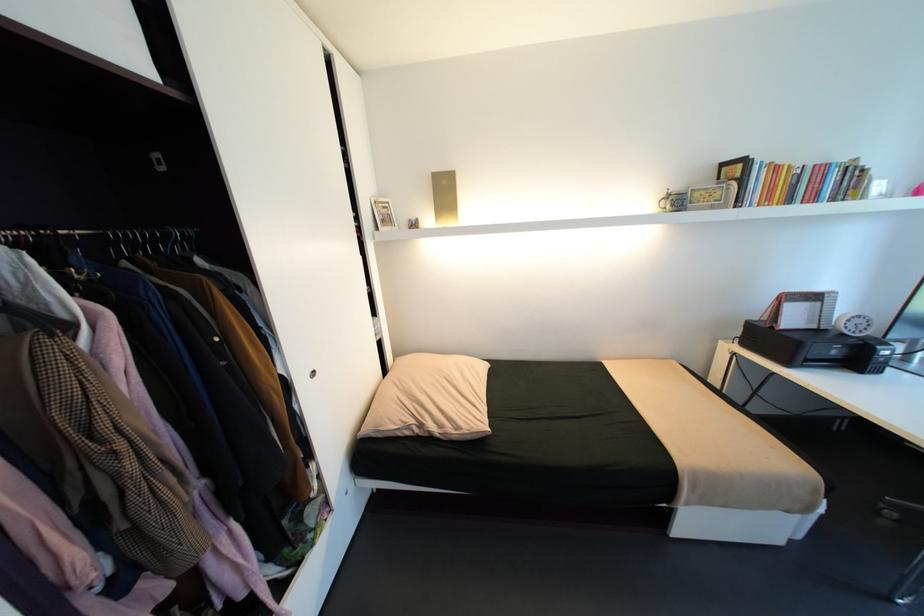
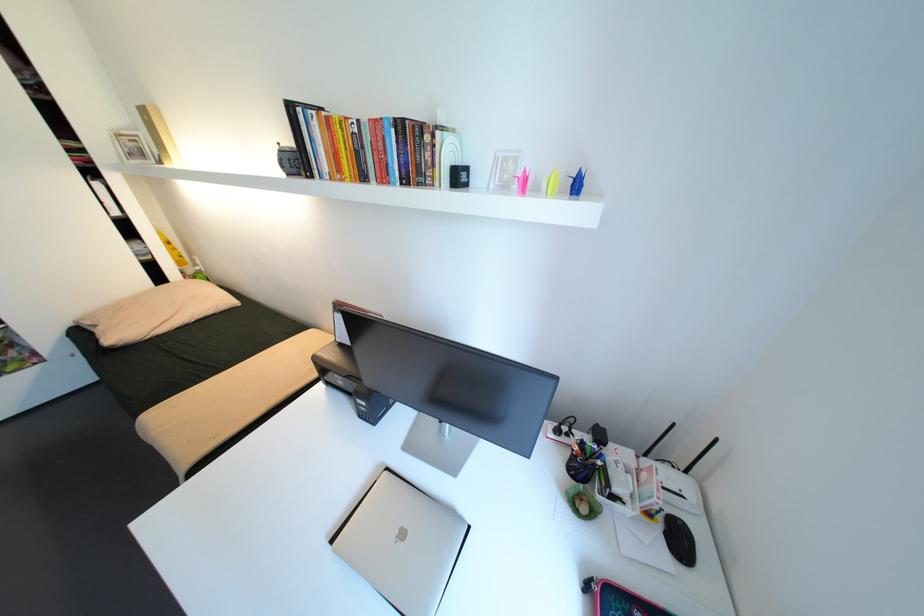
Question: Which direction would the cameraman need to move to produce the second image? Reply with the corresponding letter.

Choices:
 (A) Left
 (B) Right
 (C) Forward
 (D) Backward

Answer: (B)